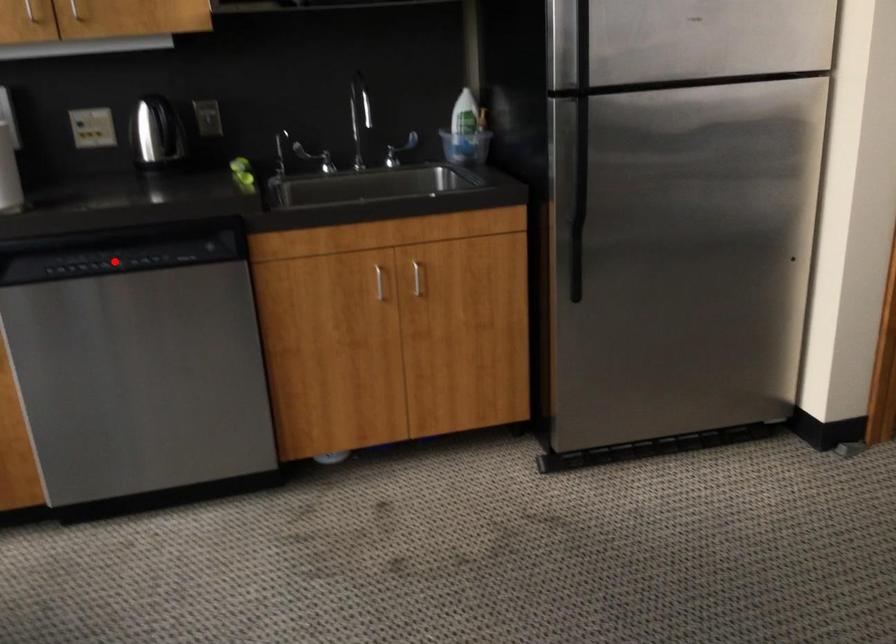
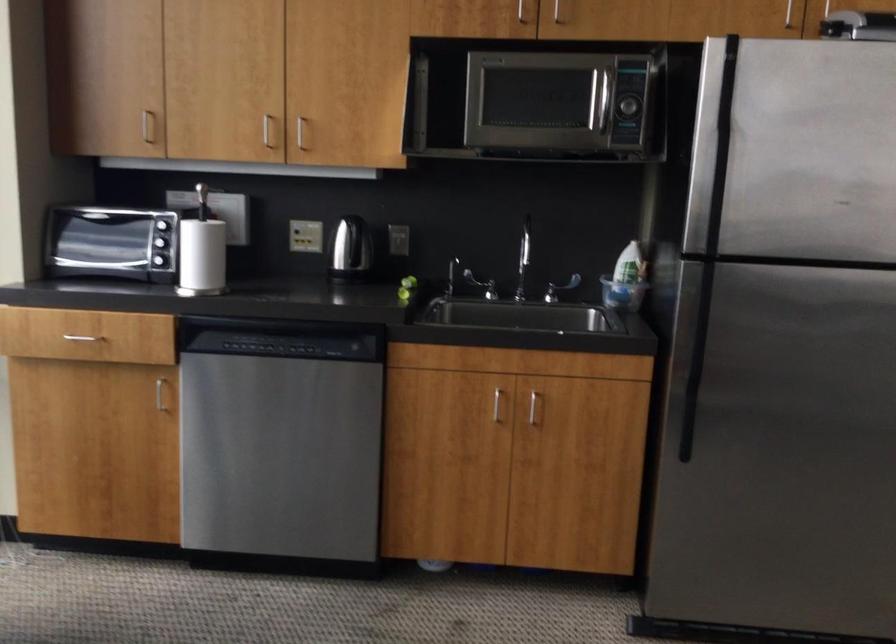
Question: A red point is marked in image1. In image2, is the corresponding 3D point closer to the camera or farther? Reply with the corresponding letter.

Choices:
 (A) The corresponding 3D point is closer.
 (B) The corresponding 3D point is farther.

Answer: (B)